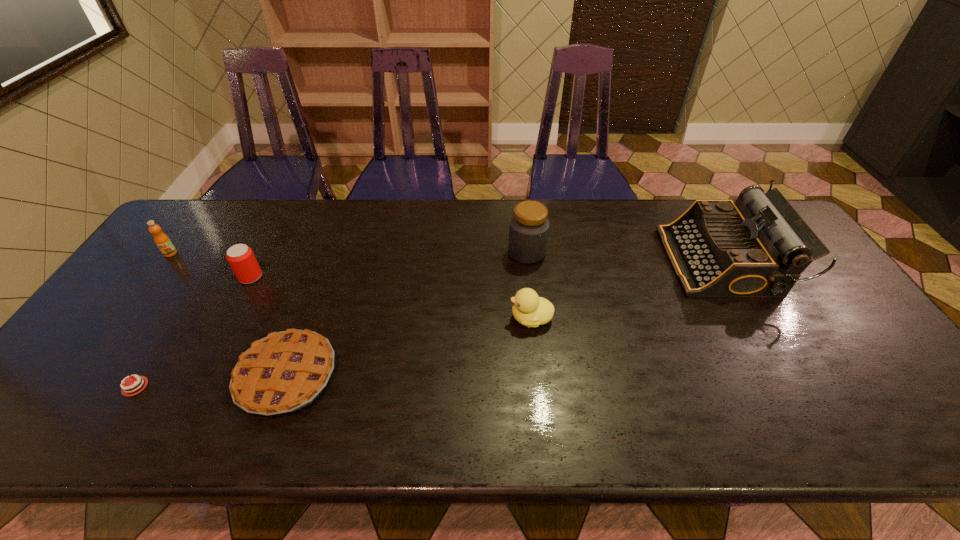
Locate an element on the screen. This screenshot has height=540, width=960. free point between the orange juice and the chocolate cake is located at coordinates (153, 320).

You are a GUI agent. You are given a task and a screenshot of the screen. Output one action in this format:
    pyautogui.click(x=<x>, y=<y>)
    Task: Click on the free point between the fifth object from right to left and the orange juice
    The image size is (960, 540).
    Given the screenshot: What is the action you would take?
    pyautogui.click(x=210, y=265)

You are a GUI agent. You are given a task and a screenshot of the screen. Output one action in this format:
    pyautogui.click(x=<x>, y=<y>)
    Task: Click on the free area in between the jar and the leftmost object
    The height and width of the screenshot is (540, 960).
    Given the screenshot: What is the action you would take?
    pyautogui.click(x=348, y=253)

Where is `free spot between the leftmost object and the chocolate cake`? This screenshot has width=960, height=540. free spot between the leftmost object and the chocolate cake is located at coordinates (153, 320).

Find the location of a particular element. This screenshot has width=960, height=540. vacant space in between the rightmost object and the jar is located at coordinates (624, 256).

Select which object is the fifth closest to the duckling. Please provide its 2D coordinates. Your answer should be formatted as a tuple, i.e. [(x, y)], where the tuple contains the x and y coordinates of a point satisfying the conditions above.

[(124, 392)]

Select which object is the second closest to the fifth object from right to left. Please provide its 2D coordinates. Your answer should be formatted as a tuple, i.e. [(x, y)], where the tuple contains the x and y coordinates of a point satisfying the conditions above.

[(163, 242)]

I want to click on free space that satisfies the following two spatial constraints: 1. on the front label of the leftmost object; 2. on the left side of the pie, so click(79, 377).

Where is `free space that satisfies the following two spatial constraints: 1. on the surface of the jar near the warning symbol; 2. on the front label of the orange juice`? The height and width of the screenshot is (540, 960). free space that satisfies the following two spatial constraints: 1. on the surface of the jar near the warning symbol; 2. on the front label of the orange juice is located at coordinates (527, 253).

This screenshot has height=540, width=960. In order to click on vacant space that satisfies the following two spatial constraints: 1. on the front label of the beer can; 2. on the right side of the orange juice in this screenshot , I will do `click(153, 277)`.